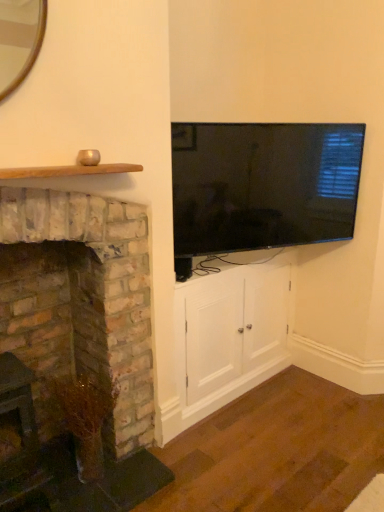
Locate an element on the screen. brick fireplace at left is located at coordinates (80, 339).

Can you confirm if white wood cabinet at center is positioned to the left of flat-screen tv at upper right?

Correct, you'll find white wood cabinet at center to the left of flat-screen tv at upper right.

Where is `cabinetry behind the flat-screen tv at upper right`? The image size is (384, 512). cabinetry behind the flat-screen tv at upper right is located at coordinates (230, 333).

From the image's perspective, is white wood cabinet at center above flat-screen tv at upper right?

Actually, white wood cabinet at center appears below flat-screen tv at upper right in the image.

Which of these two, white wood cabinet at center or flat-screen tv at upper right, stands taller?

white wood cabinet at center.

How far apart are brick fireplace at left and white wood cabinet at center?

The distance of brick fireplace at left from white wood cabinet at center is 21.84 inches.

Is brick fireplace at left inside or outside of white wood cabinet at center?

brick fireplace at left exists outside the volume of white wood cabinet at center.

Between brick fireplace at left and white wood cabinet at center, which one has larger width?

Wider between the two is brick fireplace at left.

Looking at this image, which is nearer, (42,202) or (226,302)?

Point (42,202) is closer to the camera than point (226,302).

From the image's perspective, is flat-screen tv at upper right above or below brick fireplace at left?

From the image's perspective, flat-screen tv at upper right appears above brick fireplace at left.

Considering the relative positions of flat-screen tv at upper right and brick fireplace at left in the image provided, is flat-screen tv at upper right to the left of brick fireplace at left from the viewer's perspective?

In fact, flat-screen tv at upper right is to the right of brick fireplace at left.

Between flat-screen tv at upper right and brick fireplace at left, which one is positioned behind?

flat-screen tv at upper right is behind.

Is flat-screen tv at upper right smaller than brick fireplace at left?

Yes, flat-screen tv at upper right is smaller than brick fireplace at left.

Is white wood cabinet at center touching brick fireplace at left?

No, white wood cabinet at center is not beside brick fireplace at left.

Considering the relative positions of white wood cabinet at center and brick fireplace at left in the image provided, is white wood cabinet at center to the left or to the right of brick fireplace at left?

From the image, it's evident that white wood cabinet at center is to the right of brick fireplace at left.

Looking at this image, is brick fireplace at left at the back of white wood cabinet at center?

No, white wood cabinet at center's orientation is not away from brick fireplace at left.

Is white wood cabinet at center positioned behind brick fireplace at left?

That is True.

Is point (331, 189) farther from camera compared to point (228, 400)?

No.

From a real-world perspective, is flat-screen tv at upper right physically above white wood cabinet at center?

Yes, from a real-world perspective, flat-screen tv at upper right is above white wood cabinet at center.

From the image's perspective, is flat-screen tv at upper right located beneath white wood cabinet at center?

No, from the image's perspective, flat-screen tv at upper right is not beneath white wood cabinet at center.

Which is in front, brick fireplace at left or flat-screen tv at upper right?

brick fireplace at left.

Between brick fireplace at left and flat-screen tv at upper right, which one appears on the right side from the viewer's perspective?

flat-screen tv at upper right.

Considering the points (134, 495) and (208, 136), which point is in front, point (134, 495) or point (208, 136)?

Point (134, 495)

From the picture: From a real-world perspective, relative to flat-screen tv at upper right, is brick fireplace at left vertically above or below?

brick fireplace at left is situated lower than flat-screen tv at upper right in the real world.

The width and height of the screenshot is (384, 512). What are the coordinates of `television above the white wood cabinet at center (from a real-world perspective)` in the screenshot? It's located at (263, 185).

Find the location of a particular element. cabinetry below the brick fireplace at left (from a real-world perspective) is located at coordinates (230, 333).

When comparing their distances from brick fireplace at left, does flat-screen tv at upper right or white wood cabinet at center seem closer?

white wood cabinet at center is closer to brick fireplace at left.

When comparing their distances from flat-screen tv at upper right, does brick fireplace at left or white wood cabinet at center seem further?

brick fireplace at left is positioned further to the anchor flat-screen tv at upper right.

Based on their spatial positions, is brick fireplace at left or flat-screen tv at upper right closer to white wood cabinet at center?

Among the two, flat-screen tv at upper right is located nearer to white wood cabinet at center.

Estimate the real-world distances between objects in this image. Which object is further from flat-screen tv at upper right, white wood cabinet at center or brick fireplace at left?

brick fireplace at left.

Which object lies nearer to the anchor point white wood cabinet at center, flat-screen tv at upper right or brick fireplace at left?

flat-screen tv at upper right is positioned closer to the anchor white wood cabinet at center.

When comparing their distances from brick fireplace at left, does white wood cabinet at center or flat-screen tv at upper right seem closer?

Among the two, white wood cabinet at center is located nearer to brick fireplace at left.

Identify the location of cabinetry located between brick fireplace at left and flat-screen tv at upper right in the left-right direction. (230, 333).